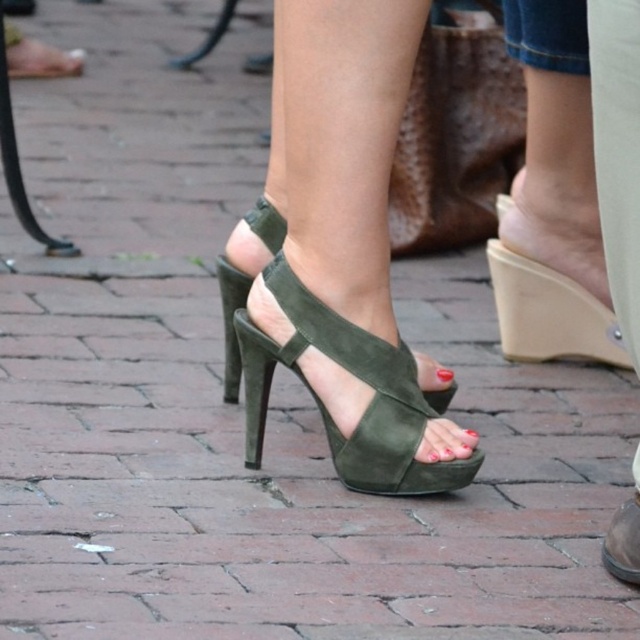
Can you confirm if green suede high-heeled sandal at center is positioned above green suede toe at center?

Yes, green suede high-heeled sandal at center is above green suede toe at center.

Is green suede high-heeled sandal at center positioned before green suede toe at center?

No.

This screenshot has height=640, width=640. I want to click on green suede high-heeled sandal at center, so click(230, 321).

Does point (332, 435) come closer to viewer compared to point (604, 544)?

No, (332, 435) is further to viewer.

Can you confirm if suede green sandal at center is thinner than leather high-heeled sandal at center?

Incorrect, suede green sandal at center's width is not less than leather high-heeled sandal at center's.

Where is `suede green sandal at center`? suede green sandal at center is located at coordinates (358, 380).

Does green suede toe at center have a smaller size compared to red matte nail polish at center?

Correct, green suede toe at center occupies less space than red matte nail polish at center.

Is point (451, 380) farther from viewer compared to point (465, 433)?

That is True.

Identify the location of green suede toe at center. The image size is (640, 640). (444, 374).